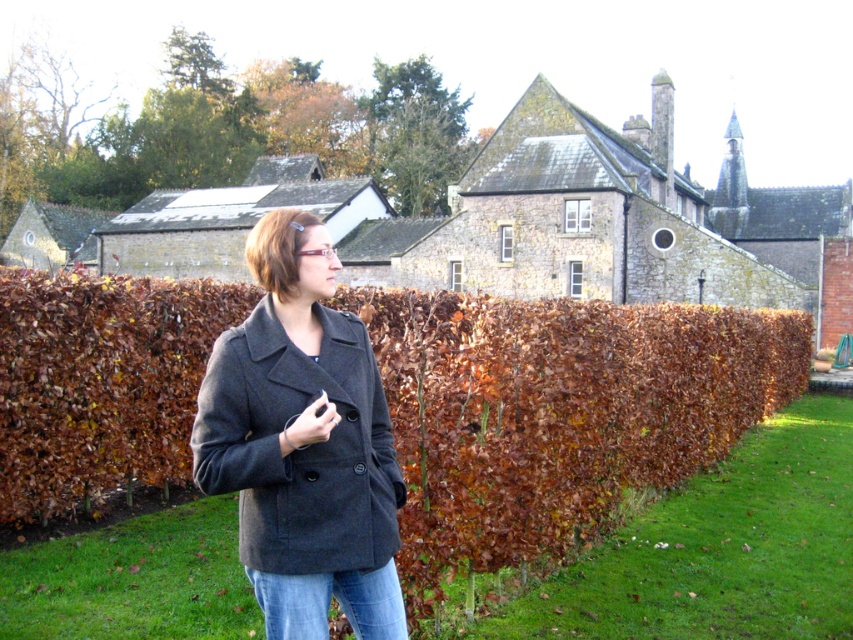
You are standing in a garden and see a point marked at coordinates (556, 413). Based on the scene description, what object does this point correspond to?

The point corresponds to the brown leafy hedge at center.

You are standing in a garden and want to take a photo of a specific point located at coordinates point (195, 308). If your camera has a maximum focus range of 25 meters, will it be able to focus on that point?

The distance of point (195, 308) from camera is 20.04 meters, so yes, the camera can focus on that point since it is within the 25 meters range.

You are a photographer trying to capture the matte gray coat at center and the brown leafy hedge at center in the same frame. Based on their positions, which object should you adjust your camera to focus on first if you want to include both in the shot?

The brown leafy hedge at center is to the right of the matte gray coat at center, so you should focus on the matte gray coat at center first as it is closer to the camera, ensuring both are in the frame.